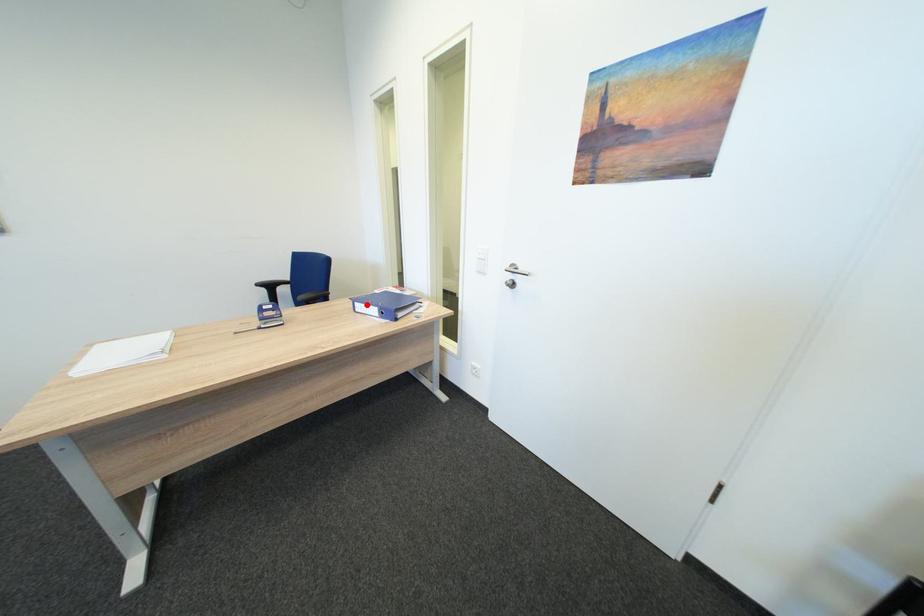
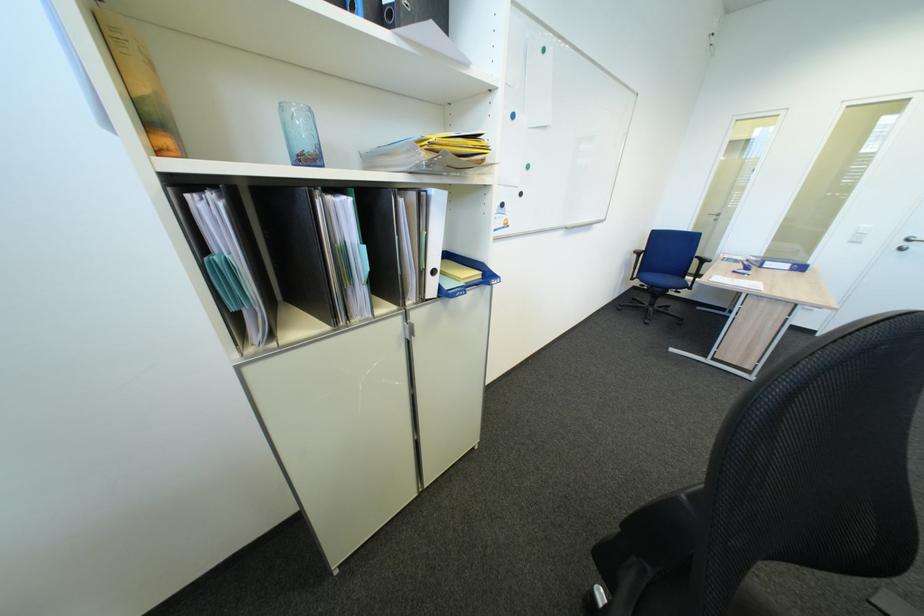
Where in the second image is the point corresponding to the highlighted location from the first image?

(776, 264)